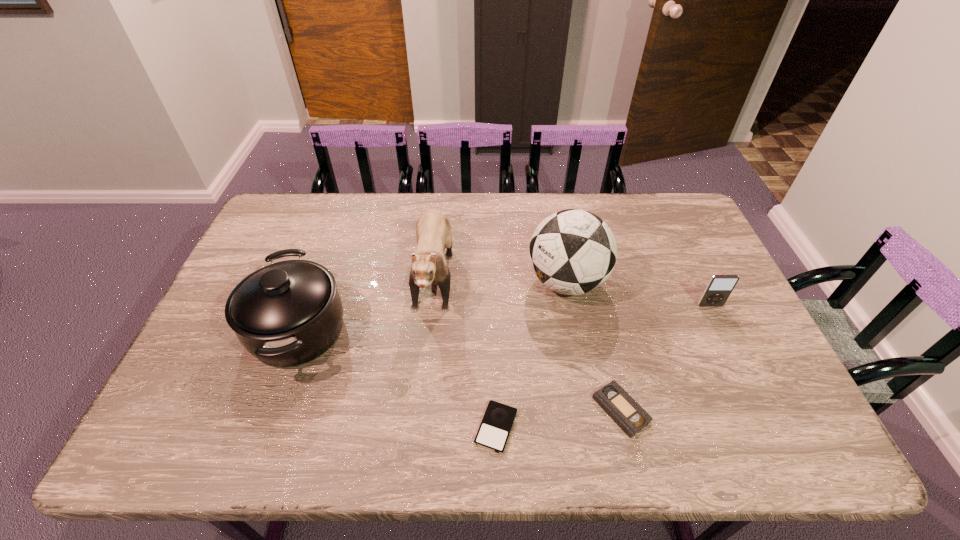
What are the coordinates of `free space that satisfies the following two spatial constraints: 1. on the face of the ferret; 2. on the left side of the fifth tallest object` in the screenshot? It's located at click(x=420, y=410).

Find the location of a particular element. Image resolution: width=960 pixels, height=540 pixels. vacant position in the image that satisfies the following two spatial constraints: 1. on the surface of the videotape where the brand logo is visible; 2. on the left side of the soccer ball is located at coordinates (590, 410).